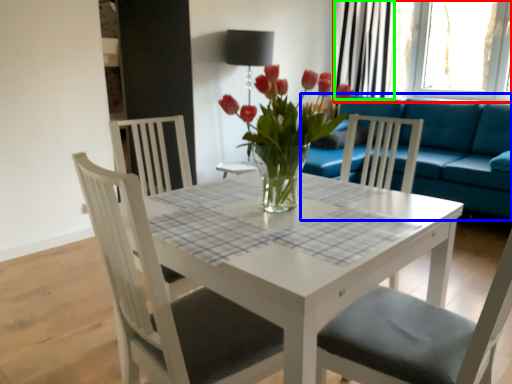
Question: Estimate the real-world distances between objects in this image. Which object is farther from window (highlighted by a red box), studio couch (highlighted by a blue box) or curtain (highlighted by a green box)?

Choices:
 (A) studio couch
 (B) curtain

Answer: (A)